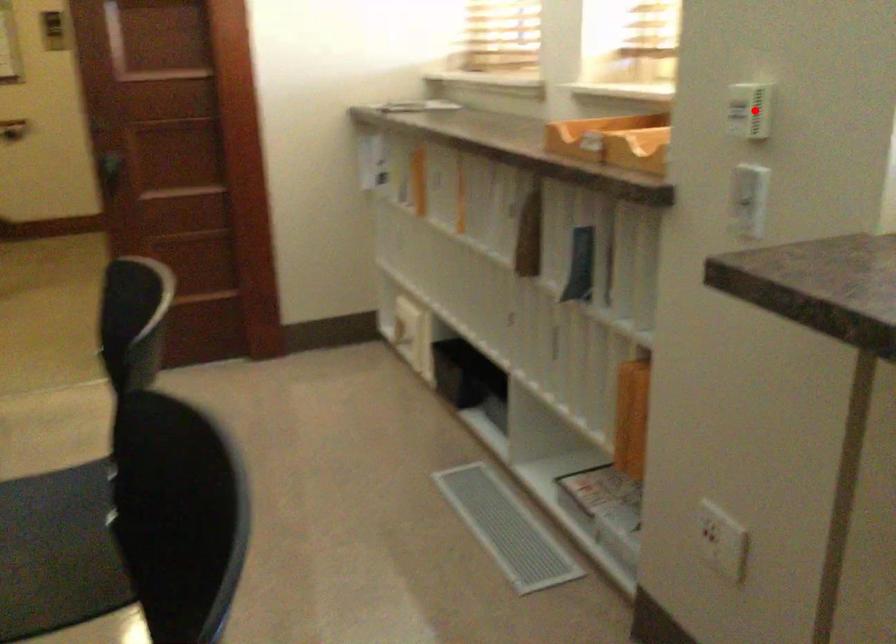
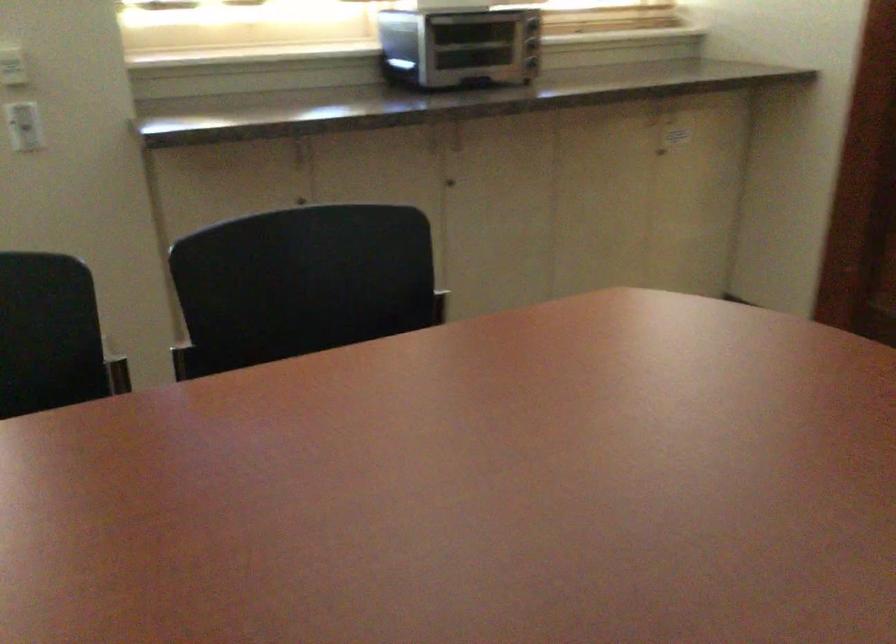
In the second image, find the point that corresponds to the highlighted location in the first image.

(11, 62)